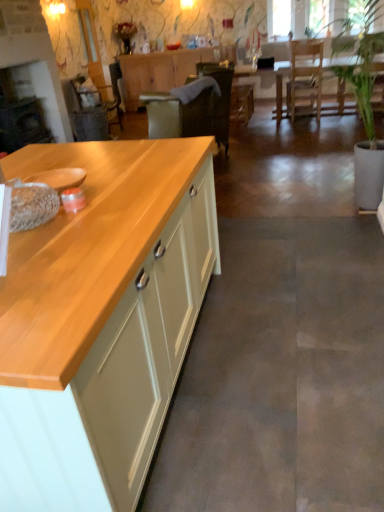
Question: Considering the relative sizes of wooden table at center and light wood/texture cabinet at left, marked as the 1th cabinetry in a bottom-to-top arrangement, in the image provided, is wooden table at center smaller than light wood/texture cabinet at left, marked as the 1th cabinetry in a bottom-to-top arrangement,?

Choices:
 (A) yes
 (B) no

Answer: (A)

Question: Is wooden table at center taller than light wood/texture cabinet at left, marked as the 1th cabinetry in a bottom-to-top arrangement?

Choices:
 (A) yes
 (B) no

Answer: (B)

Question: Is wooden table at center further to the viewer compared to light wood/texture cabinet at left, the second cabinetry from the top?

Choices:
 (A) no
 (B) yes

Answer: (B)

Question: Is there a large distance between wooden table at center and light wood/texture cabinet at left, marked as the 1th cabinetry in a bottom-to-top arrangement?

Choices:
 (A) yes
 (B) no

Answer: (A)

Question: Is wooden table at center oriented towards light wood/texture cabinet at left, the second cabinetry from the top?

Choices:
 (A) no
 (B) yes

Answer: (B)

Question: Is wooden table at center to the left of light wood/texture cabinet at left, the first cabinetry from the front, from the viewer's perspective?

Choices:
 (A) yes
 (B) no

Answer: (B)

Question: From the image's perspective, is wooden armchair at left located beneath matte wood cabinet at center, the first cabinetry in the top-to-bottom sequence?

Choices:
 (A) no
 (B) yes

Answer: (B)

Question: Is wooden armchair at left behind matte wood cabinet at center, the first cabinetry in the top-to-bottom sequence?

Choices:
 (A) no
 (B) yes

Answer: (A)

Question: Does wooden armchair at left have a lesser width compared to matte wood cabinet at center, placed as the 2th cabinetry when sorted from front to back?

Choices:
 (A) yes
 (B) no

Answer: (B)

Question: Is wooden armchair at left positioned before matte wood cabinet at center, the second cabinetry in the bottom-to-top sequence?

Choices:
 (A) yes
 (B) no

Answer: (A)

Question: Is matte wood cabinet at center, placed as the 2th cabinetry when sorted from front to back, at the back of wooden armchair at left?

Choices:
 (A) no
 (B) yes

Answer: (A)

Question: Is wooden armchair at left located outside matte wood cabinet at center, the first cabinetry in the top-to-bottom sequence?

Choices:
 (A) no
 (B) yes

Answer: (B)

Question: Does matte wood cabinet at center, the first cabinetry in the top-to-bottom sequence, have a greater height compared to wooden table at center?

Choices:
 (A) no
 (B) yes

Answer: (B)